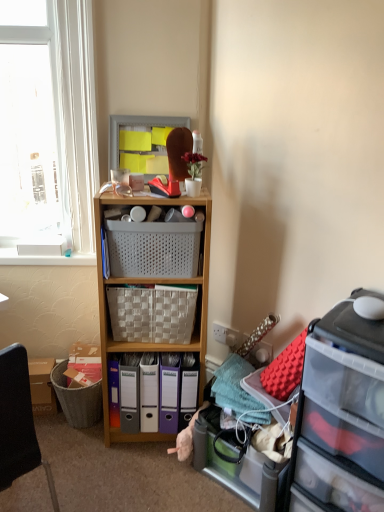
The image size is (384, 512). What are the coordinates of `vacant region in front of gray textured trash bin at lower left` in the screenshot? It's located at (71, 452).